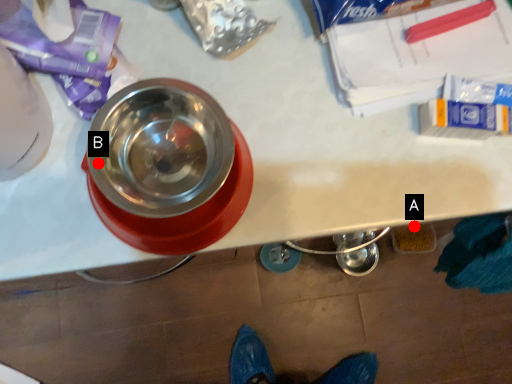
Question: Two points are circled on the image, labeled by A and B beside each circle. Which of the following is the closest to the observer?

Choices:
 (A) A is closer
 (B) B is closer

Answer: (B)